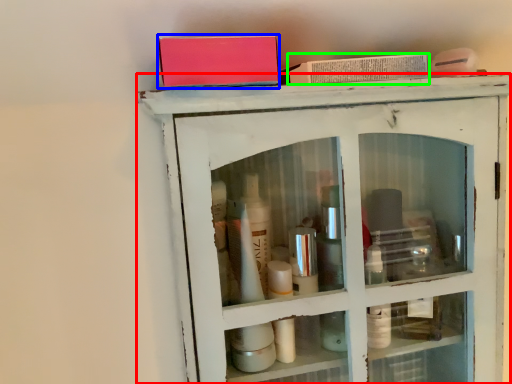
Question: Considering the real-world distances, which object is farthest from shelf (highlighted by a red box)? book (highlighted by a blue box) or book (highlighted by a green box)?

Choices:
 (A) book
 (B) book

Answer: (A)